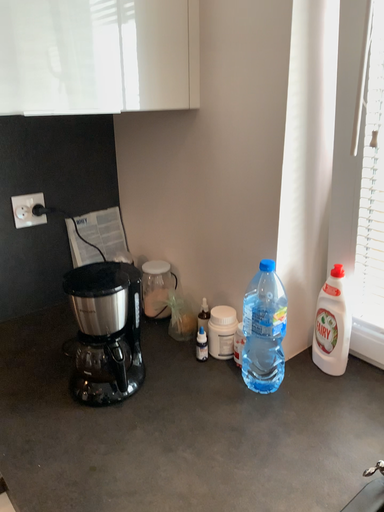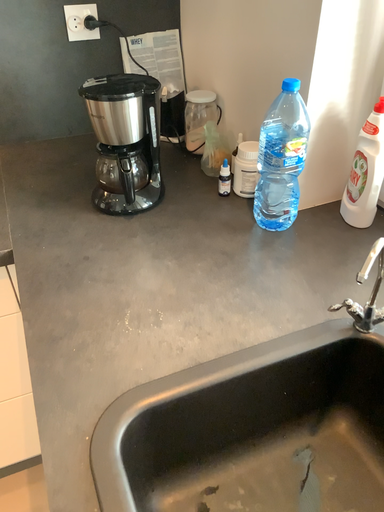
Question: Which way did the camera rotate in the video?

Choices:
 (A) rotated left
 (B) rotated right

Answer: (A)